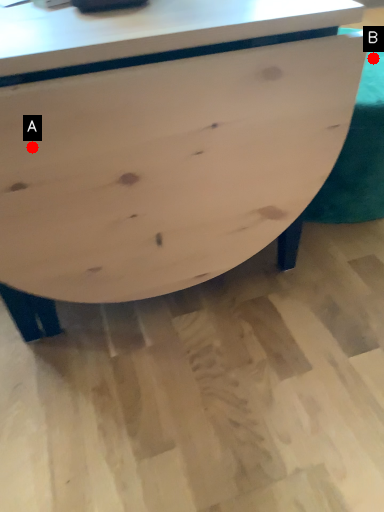
Question: Two points are circled on the image, labeled by A and B beside each circle. Which point is closer to the camera?

Choices:
 (A) A is closer
 (B) B is closer

Answer: (A)